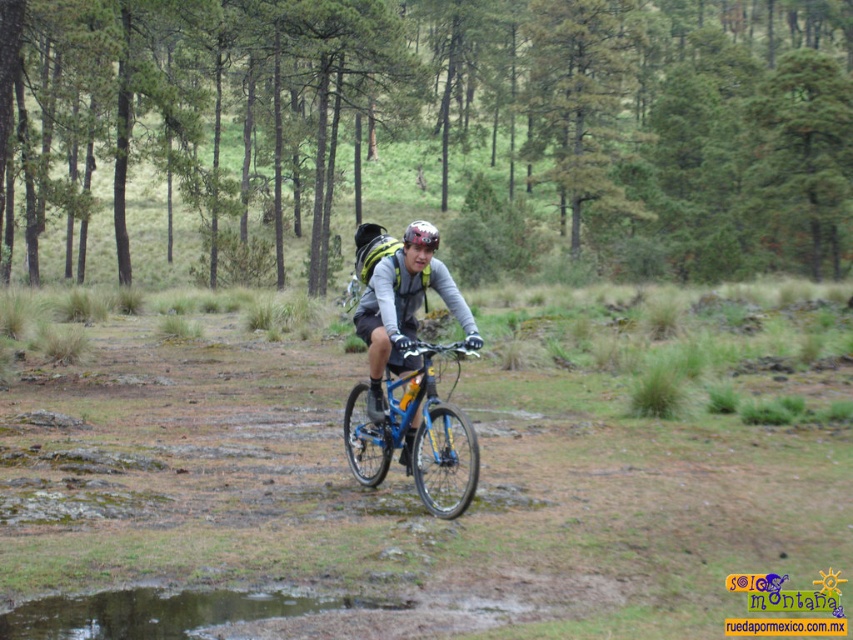
You are a delivery robot with a width of 1.5 meters. You need to pass through a narrow path between the blue metallic bicycle at center and the shiny silver helmet at center. Can you fit through the space between them?

The distance between the blue metallic bicycle at center and the shiny silver helmet at center is 1.51 meters. Since the robot is 1.5 meters wide, it can just barely fit through the space between them.